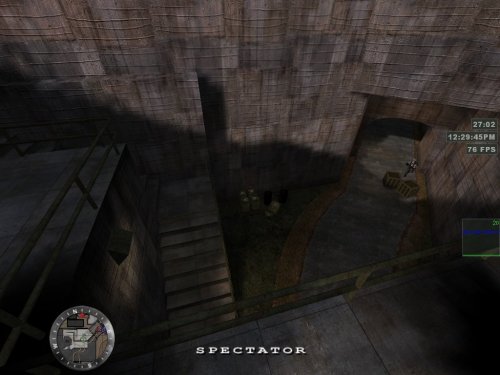
This screenshot has width=500, height=375. In order to click on stairs in this screenshot , I will do `click(215, 259)`.